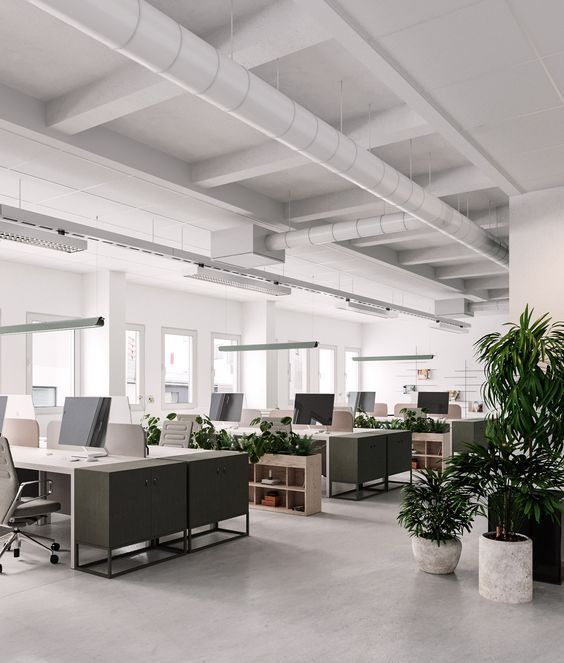
In order to click on hanging wires in this screenshot , I will do `click(336, 111)`, `click(372, 115)`, `click(411, 158)`, `click(437, 170)`, `click(458, 202)`, `click(462, 204)`, `click(484, 207)`, `click(495, 211)`, `click(268, 72)`, `click(233, 44)`.